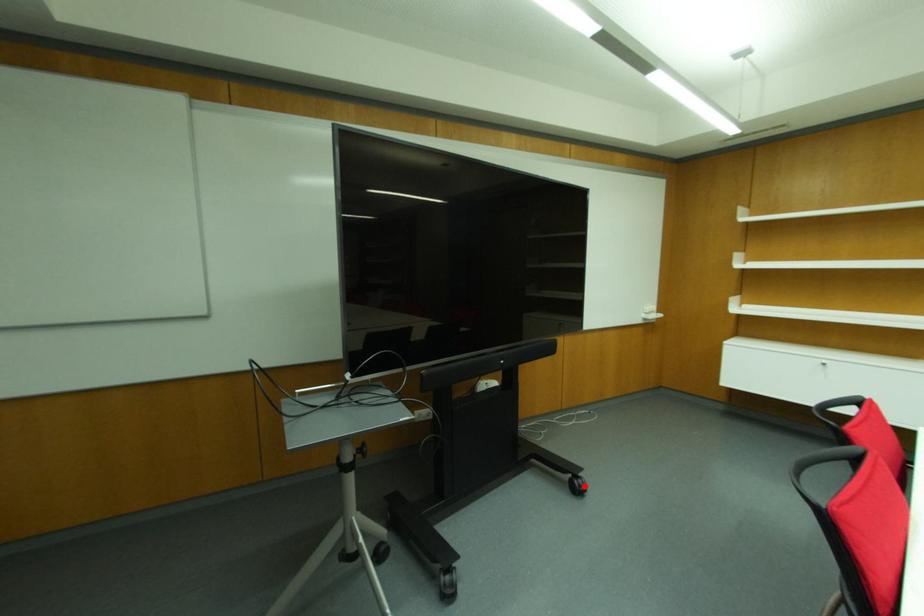
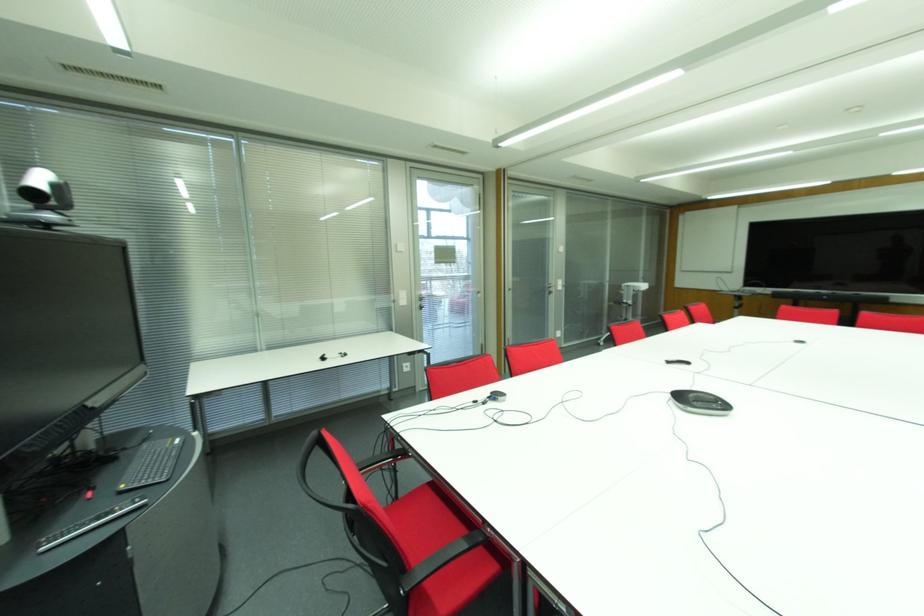
Question: I am providing you with two images of the same scene from different viewpoints. A red point is marked on the first image. Is the red point's position out of view in image 2?

Choices:
 (A) Yes
 (B) No

Answer: (A)